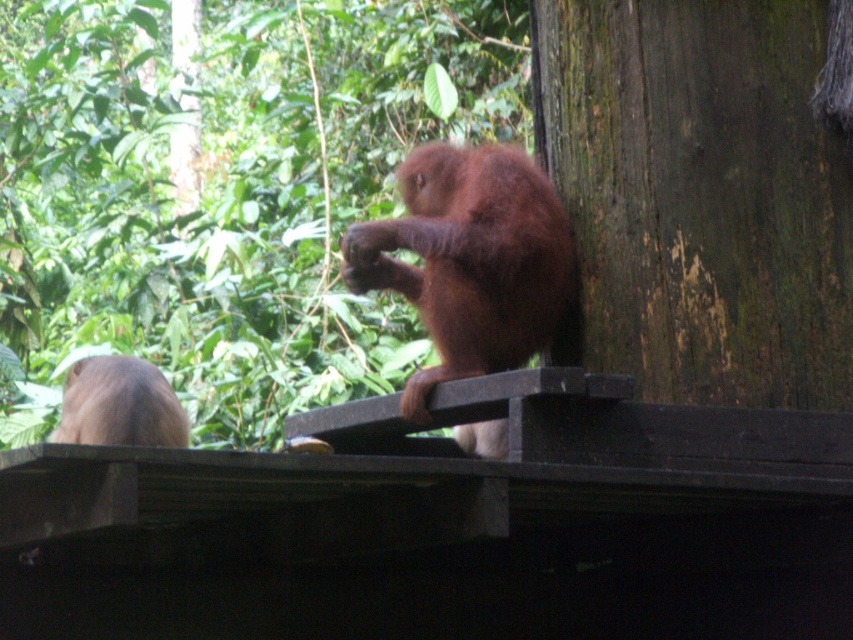
The image size is (853, 640). What do you see at coordinates (227, 195) in the screenshot?
I see `smooth brown tree trunk at upper right` at bounding box center [227, 195].

Where is `smooth brown tree trunk at upper right`? The image size is (853, 640). smooth brown tree trunk at upper right is located at coordinates (227, 195).

Who is positioned more to the right, dark brown wood at right or brown furry monkey at center?

dark brown wood at right

Which is in front, point (659, 337) or point (498, 332)?

Point (659, 337) is in front.

Image resolution: width=853 pixels, height=640 pixels. Find the location of `dark brown wood at right`. dark brown wood at right is located at coordinates (701, 195).

Is point (67, 26) farther from camera compared to point (454, 177)?

That is True.

Which is above, smooth brown tree trunk at upper right or brown furry monkey at center?

smooth brown tree trunk at upper right is higher up.

Is point (125, 140) closer to camera compared to point (553, 236)?

That is False.

Locate an element on the screen. smooth brown tree trunk at upper right is located at coordinates (227, 195).